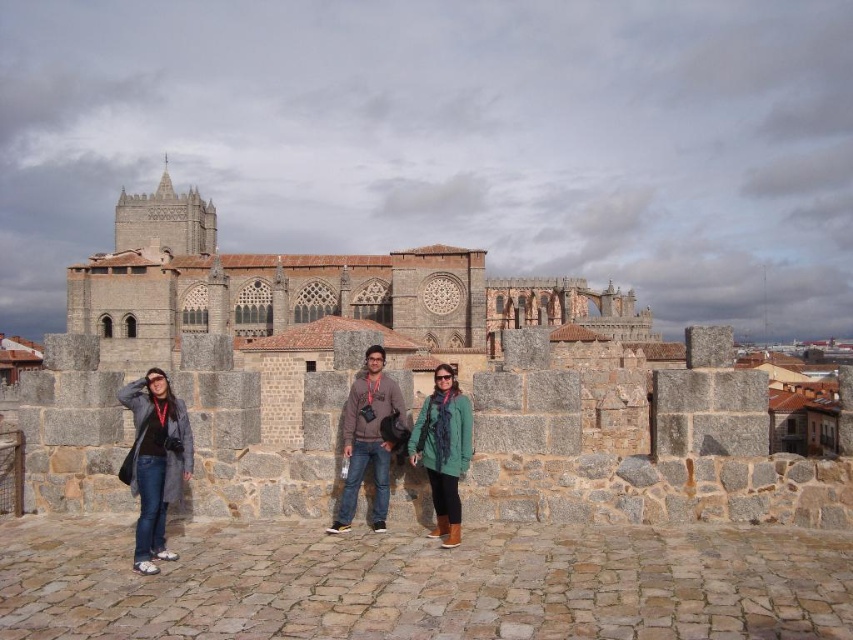
Question: Among these points, which one is farthest from the camera?

Choices:
 (A) (372, 529)
 (B) (462, 464)
 (C) (306, 284)

Answer: (C)

Question: Which object is farther from the camera taking this photo?

Choices:
 (A) gray wool coat at left
 (B) green fuzzy sweater at center
 (C) green wool scarf at center

Answer: (C)

Question: Observing the image, what is the correct spatial positioning of gray stone fort at center in reference to green wool scarf at center?

Choices:
 (A) left
 (B) right

Answer: (B)

Question: Which is farther from the green fuzzy sweater at center?

Choices:
 (A) gray stone fort at center
 (B) gray wool coat at left

Answer: (A)

Question: Considering the relative positions of green wool scarf at center and gray wool coat at left in the image provided, where is green wool scarf at center located with respect to gray wool coat at left?

Choices:
 (A) right
 (B) left

Answer: (A)

Question: Is gray stone fort at center positioned at the back of gray wool coat at left?

Choices:
 (A) no
 (B) yes

Answer: (B)